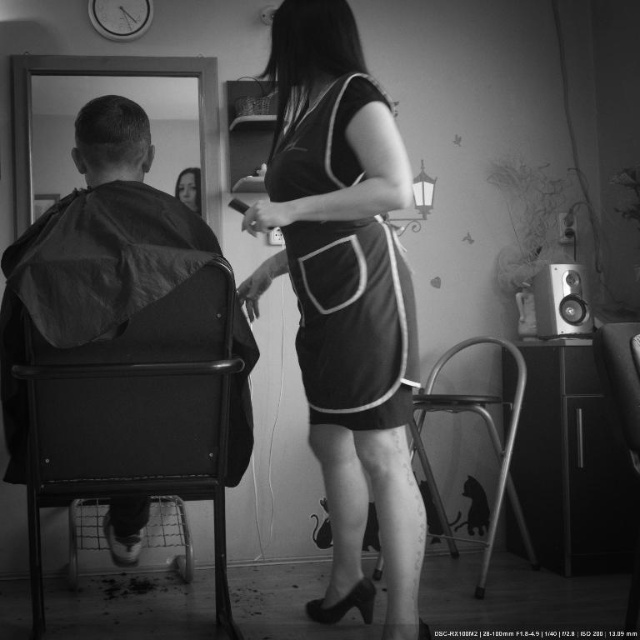
Does metallic silver chair at lower center have a lesser width compared to metallic silver speaker at right?

No.

Which is more to the left, metallic silver chair at lower center or metallic silver speaker at right?

metallic silver chair at lower center

The image size is (640, 640). Describe the element at coordinates (490, 442) in the screenshot. I see `metallic silver chair at lower center` at that location.

The height and width of the screenshot is (640, 640). In order to click on metallic silver chair at lower center in this screenshot , I will do `click(490, 442)`.

Can you confirm if velvet dress at center is thinner than metallic silver chair at lower center?

In fact, velvet dress at center might be wider than metallic silver chair at lower center.

Who is more distant from viewer, (376, 458) or (480, 584)?

Positioned behind is point (480, 584).

Does point (320, 188) come closer to viewer compared to point (449, 410)?

That is True.

Identify the location of velvet dress at center. The height and width of the screenshot is (640, 640). (346, 298).

Which is below, black matte dress at center or metallic silver speaker at right?

metallic silver speaker at right

Who is more distant from viewer, (364,356) or (572,301)?

The point (572,301) is behind.

What are the coordinates of `black matte dress at center` in the screenshot? It's located at (353, 323).

You are a GUI agent. You are given a task and a screenshot of the screen. Output one action in this format:
    pyautogui.click(x=<x>, y=<y>)
    Task: Click on the black matte dress at center
    Image resolution: width=640 pixels, height=640 pixels.
    Given the screenshot: What is the action you would take?
    pyautogui.click(x=353, y=323)